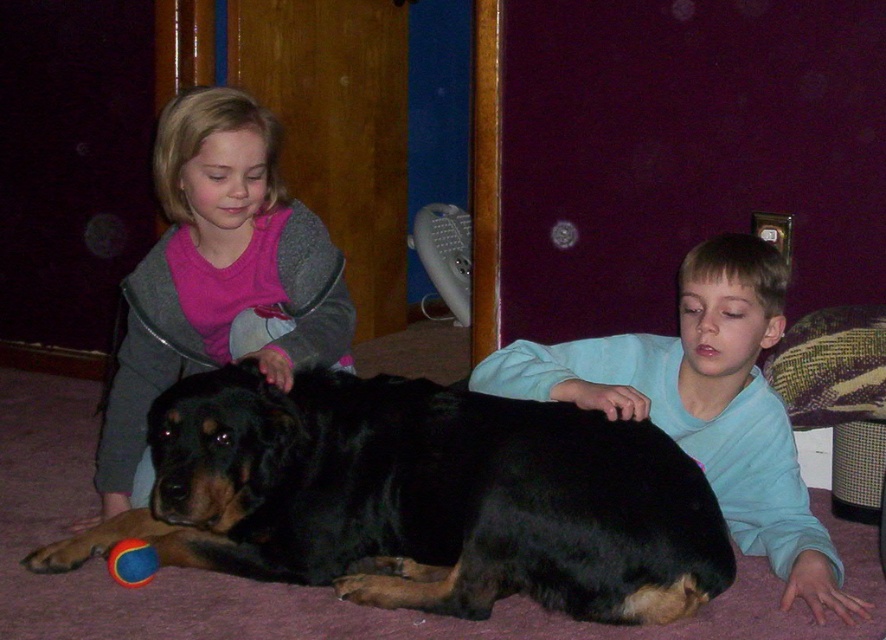
You are a parent trying to choose between two items for your child. You see the smooth blue shirt at lower right and the rubber ball at lower left. Which item is larger in size?

The smooth blue shirt at lower right is bigger than the rubber ball at lower left.

You are a photographer trying to capture the black glossy fur at center in the image. The camera you are using has a focus point at coordinate point (420, 499). Based on the scene description, will this focus point help you capture the black glossy fur at center?

Yes, the point (420, 499) marks the black glossy fur at center, so using this focus point will help capture it accurately.

You are a photographer trying to capture a closeup of the black glossy fur at center without the matte pink shirt at upper left appearing in the frame. Is this possible based on their positions?

Yes, because the black glossy fur at center is in front of the matte pink shirt at upper left, you can position the camera to focus on the black glossy fur at center while blocking the matte pink shirt at upper left from view.